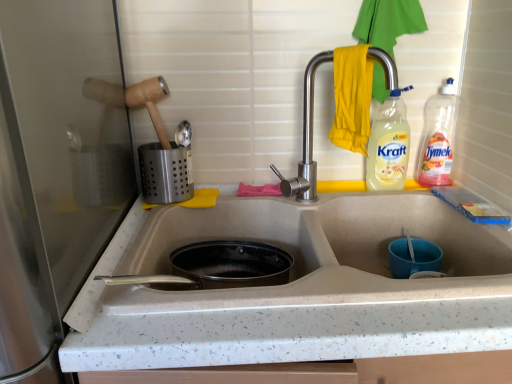
Where is `vacant space to the left of translucent plastic bottle at upper right, the second bottle in the right-to-left sequence`? vacant space to the left of translucent plastic bottle at upper right, the second bottle in the right-to-left sequence is located at coordinates (327, 194).